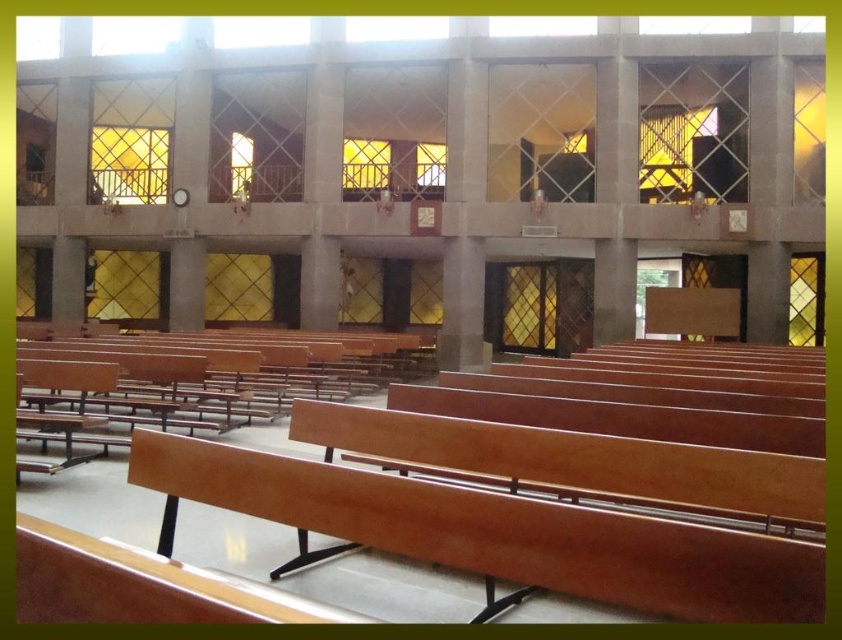
Does point (232, 476) come closer to viewer compared to point (105, 413)?

Yes, point (232, 476) is closer to viewer.

Is point (750, 451) farther from viewer compared to point (249, 344)?

No, (750, 451) is in front of (249, 344).

The image size is (842, 640). Describe the element at coordinates (526, 508) in the screenshot. I see `wooden church bench at center` at that location.

Locate an element on the screen. wooden church bench at center is located at coordinates (526, 508).